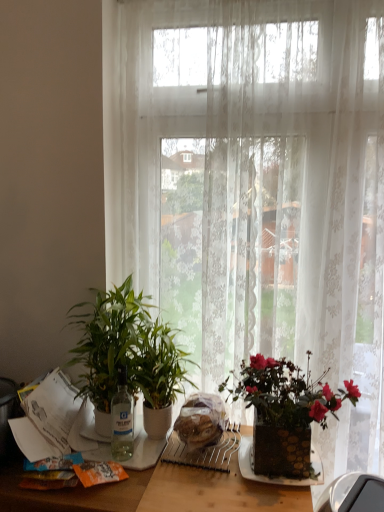
In order to face wooden table at center, should I rotate leftwards or rightwards?

You should look left and rotate roughly 3.993 degrees.

At what (x,y) coordinates should I click in order to perform the action: click on green glossy plant at left, the second houseplant positioned from the right. Please return your answer as a coordinate pair (x, y). Looking at the image, I should click on (108, 345).

Describe the element at coordinates (159, 376) in the screenshot. I see `green glossy plant at center, which is the 2th houseplant in left-to-right order` at that location.

This screenshot has width=384, height=512. I want to click on white lace curtain at center, so click(x=255, y=188).

At what (x,y) coordinates should I click in order to perform the action: click on translucent plastic bread at center. Please return your answer as a coordinate pair (x, y). The width and height of the screenshot is (384, 512). Looking at the image, I should click on (201, 420).

This screenshot has width=384, height=512. What do you see at coordinates (280, 475) in the screenshot? I see `matte brown plate at center` at bounding box center [280, 475].

This screenshot has height=512, width=384. Find the location of `wooden table at center`. wooden table at center is located at coordinates (157, 492).

What's the angular difference between transparent glass bottle at center and green glossy plant at center, which is the 2th houseplant in left-to-right order,'s facing directions?

transparent glass bottle at center and green glossy plant at center, which is the 2th houseplant in left-to-right order, are facing 0.00745 degrees away from each other.

Considering the sizes of objects transparent glass bottle at center and green glossy plant at center, which is the 2th houseplant in left-to-right order, in the image provided, who is taller, transparent glass bottle at center or green glossy plant at center, which is the 2th houseplant in left-to-right order,?

green glossy plant at center, which is the 2th houseplant in left-to-right order.

Could you tell me if transparent glass bottle at center is turned towards green glossy plant at center, which is the 2th houseplant in left-to-right order?

Yes, transparent glass bottle at center is aimed at green glossy plant at center, which is the 2th houseplant in left-to-right order.

Who is smaller, transparent glass bottle at center or green glossy plant at center, acting as the 1th houseplant starting from the right?

transparent glass bottle at center is smaller.

Looking at this image, between matte brown plate at center and white lace curtain at center, which one appears on the right side from the viewer's perspective?

matte brown plate at center is more to the right.

Considering their positions, is matte brown plate at center located in front of or behind white lace curtain at center?

matte brown plate at center is in front of white lace curtain at center.

Is matte brown plate at center positioned with its back to white lace curtain at center?

Yes.

Is matte brown plate at center taller than white lace curtain at center?

Incorrect, the height of matte brown plate at center is not larger of that of white lace curtain at center.

Are green glossy plant at left, marked as the 1th houseplant in a left-to-right arrangement, and translucent plastic bread at center located far from each other?

Actually, green glossy plant at left, marked as the 1th houseplant in a left-to-right arrangement, and translucent plastic bread at center are a little close together.

Considering the relative sizes of green glossy plant at left, the second houseplant positioned from the right, and translucent plastic bread at center in the image provided, is green glossy plant at left, the second houseplant positioned from the right, taller than translucent plastic bread at center?

Correct, green glossy plant at left, the second houseplant positioned from the right, is much taller as translucent plastic bread at center.

Is translucent plastic bread at center inside green glossy plant at left, marked as the 1th houseplant in a left-to-right arrangement?

No, translucent plastic bread at center is not inside green glossy plant at left, marked as the 1th houseplant in a left-to-right arrangement.

From the picture: Does green glossy plant at left, the second houseplant positioned from the right, have a larger size compared to translucent plastic bread at center?

Yes, green glossy plant at left, the second houseplant positioned from the right, is bigger than translucent plastic bread at center.

Is green glossy plant at left, the second houseplant positioned from the right, facing towards wooden table at center?

No, green glossy plant at left, the second houseplant positioned from the right, is not oriented towards wooden table at center.

From a real-world perspective, is green glossy plant at left, the second houseplant positioned from the right, under wooden table at center?

No, from a real-world perspective, green glossy plant at left, the second houseplant positioned from the right, is not under wooden table at center.

Considering the relative positions of green glossy plant at left, the second houseplant positioned from the right, and wooden table at center in the image provided, is green glossy plant at left, the second houseplant positioned from the right, to the right of wooden table at center from the viewer's perspective?

Incorrect, green glossy plant at left, the second houseplant positioned from the right, is not on the right side of wooden table at center.

From a real-world perspective, which object stands above the other?

white lace curtain at center.

Looking at this image, is white lace curtain at center thinner than translucent plastic bread at center?

Yes, white lace curtain at center is thinner than translucent plastic bread at center.

Is white lace curtain at center spatially inside translucent plastic bread at center, or outside of it?

white lace curtain at center is spatially situated outside translucent plastic bread at center.

In the scene shown: Are white lace curtain at center and translucent plastic bread at center beside each other?

white lace curtain at center and translucent plastic bread at center are not in contact.

Considering the sizes of matte brown plate at center and transparent glass bottle at center in the image, is matte brown plate at center wider or thinner than transparent glass bottle at center?

Clearly, matte brown plate at center has more width compared to transparent glass bottle at center.

Is the depth of matte brown plate at center greater than that of transparent glass bottle at center?

No, the depth of matte brown plate at center is less than that of transparent glass bottle at center.

From the image's perspective, relative to transparent glass bottle at center, is matte brown plate at center above or below?

From the image's perspective, matte brown plate at center appears below transparent glass bottle at center.

In the scene shown: Who is taller, matte brown plate at center or transparent glass bottle at center?

transparent glass bottle at center.

Measure the distance from white lace curtain at center to green glossy plant at left, marked as the 1th houseplant in a left-to-right arrangement.

A distance of 19.58 inches exists between white lace curtain at center and green glossy plant at left, marked as the 1th houseplant in a left-to-right arrangement.

From a real-world perspective, is white lace curtain at center positioned over green glossy plant at left, marked as the 1th houseplant in a left-to-right arrangement, based on gravity?

Yes, from a real-world perspective, white lace curtain at center is over green glossy plant at left, marked as the 1th houseplant in a left-to-right arrangement

Is white lace curtain at center further to camera compared to green glossy plant at left, marked as the 1th houseplant in a left-to-right arrangement?

Yes, white lace curtain at center is further from the viewer.

What are the coordinates of `curtain that appears above the green glossy plant at left, the second houseplant positioned from the right (from a real-world perspective)` in the screenshot? It's located at (255, 188).

Identify the location of bottle that appears below the green glossy plant at center, which is the 2th houseplant in left-to-right order (from the image's perspective). The image size is (384, 512). (122, 419).

The width and height of the screenshot is (384, 512). I want to click on plate on the right of white lace curtain at center, so click(280, 475).

When comparing their distances from matte brown plate at center, does translucent plastic bread at center or green glossy plant at center, acting as the 1th houseplant starting from the right, seem further?

green glossy plant at center, acting as the 1th houseplant starting from the right.

Looking at the image, which one is located further to transparent glass bottle at center, wooden table at center or white lace curtain at center?

white lace curtain at center is further to transparent glass bottle at center.

From the image, which object appears to be farther from green glossy plant at center, which is the 2th houseplant in left-to-right order, matte brown plate at center or translucent plastic bread at center?

matte brown plate at center is further to green glossy plant at center, which is the 2th houseplant in left-to-right order.

Which object lies nearer to the anchor point green glossy plant at center, which is the 2th houseplant in left-to-right order, white lace curtain at center or green glossy plant at left, the second houseplant positioned from the right?

Based on the image, green glossy plant at left, the second houseplant positioned from the right, appears to be nearer to green glossy plant at center, which is the 2th houseplant in left-to-right order.

Which object lies further to the anchor point translucent plastic bread at center, wooden table at center or transparent glass bottle at center?

transparent glass bottle at center is further to translucent plastic bread at center.

Looking at the image, which one is located further to translucent plastic bread at center, green glossy plant at left, marked as the 1th houseplant in a left-to-right arrangement, or white lace curtain at center?

white lace curtain at center is further to translucent plastic bread at center.

Which object lies nearer to the anchor point green glossy plant at left, the second houseplant positioned from the right, transparent glass bottle at center or white lace curtain at center?

Based on the image, transparent glass bottle at center appears to be nearer to green glossy plant at left, the second houseplant positioned from the right.

Looking at the image, which one is located further to translucent plastic bread at center, transparent glass bottle at center or white lace curtain at center?

white lace curtain at center lies further to translucent plastic bread at center than the other object.

The width and height of the screenshot is (384, 512). I want to click on food situated between green glossy plant at left, marked as the 1th houseplant in a left-to-right arrangement, and matte brown plate at center from left to right, so click(201, 420).

Locate an element on the screen. This screenshot has height=512, width=384. houseplant located between green glossy plant at left, the second houseplant positioned from the right, and matte brown plate at center in the left-right direction is located at coordinates (159, 376).

What are the coordinates of `bottle between green glossy plant at center, acting as the 1th houseplant starting from the right, and wooden table at center, in the vertical direction` in the screenshot? It's located at (122, 419).

At what (x,y) coordinates should I click in order to perform the action: click on food that lies between green glossy plant at left, the second houseplant positioned from the right, and wooden table at center from top to bottom. Please return your answer as a coordinate pair (x, y). This screenshot has width=384, height=512. Looking at the image, I should click on (201, 420).